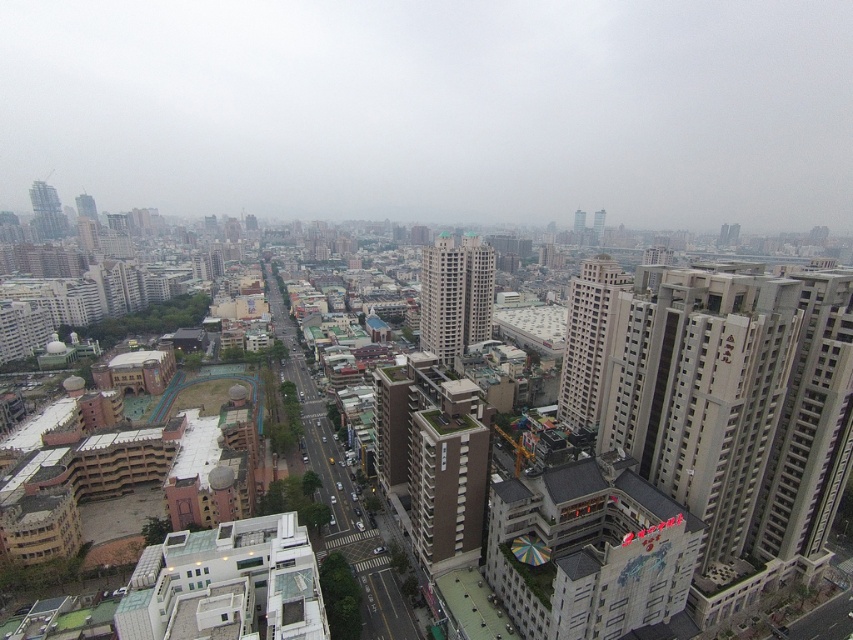
You are a drone operator trying to navigate your drone through the city. You need to fly from the transparent glass sky at upper center to a point directly above the ferris wheel attraction. What coordinate should you set as the destination?

The transparent glass sky at upper center is located at coordinate point (436, 109). To fly to the ferris wheel attraction, you should set the destination coordinate to the position where the ferris wheel is located, which is not specified in the provided information.